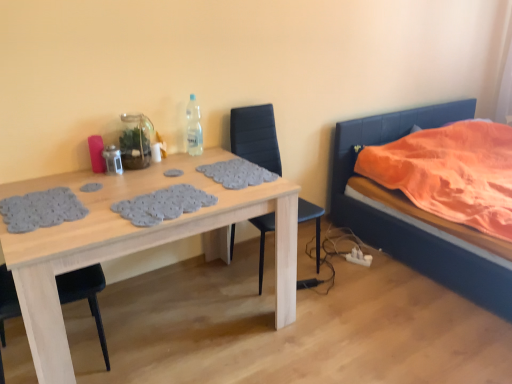
Identify the location of free spot above wooden table at center (from a real-world perspective). This screenshot has width=512, height=384. coord(137,188).